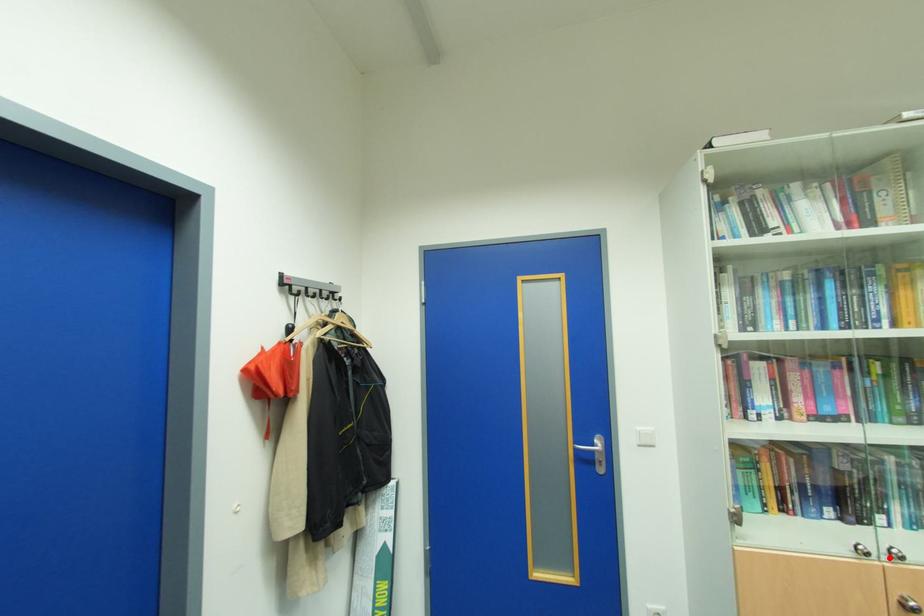
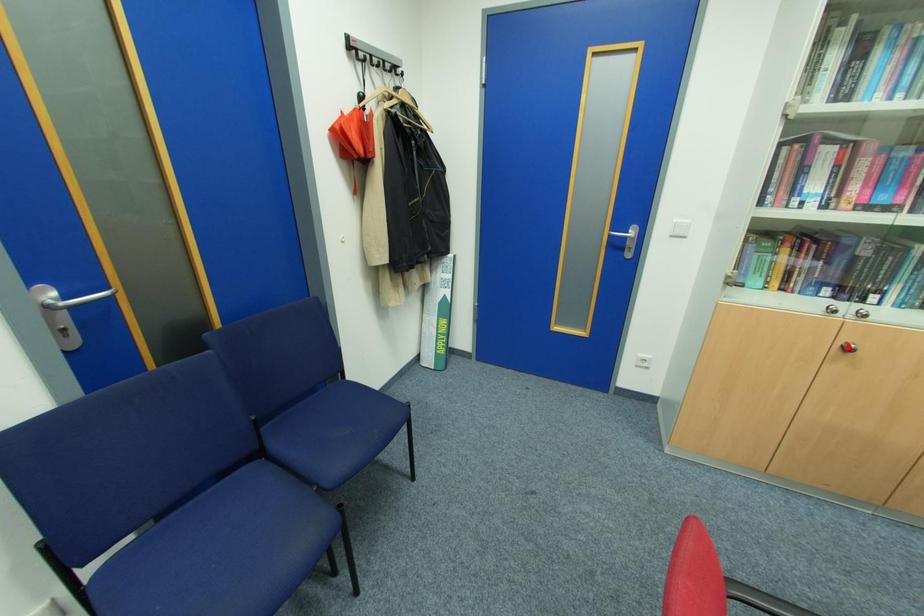
I am providing you with two images of the same scene from different viewpoints. A red point is marked on the first image and another point is marked on the second image. Is the red point in image1 aligned with the point shown in image2?

No